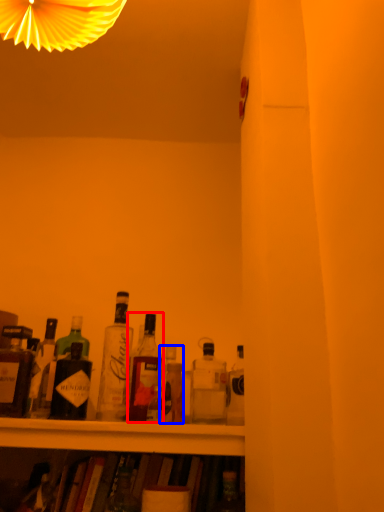
Question: Which object is closer to the camera taking this photo, bottle (highlighted by a red box) or bottle (highlighted by a blue box)?

Choices:
 (A) bottle
 (B) bottle

Answer: (B)